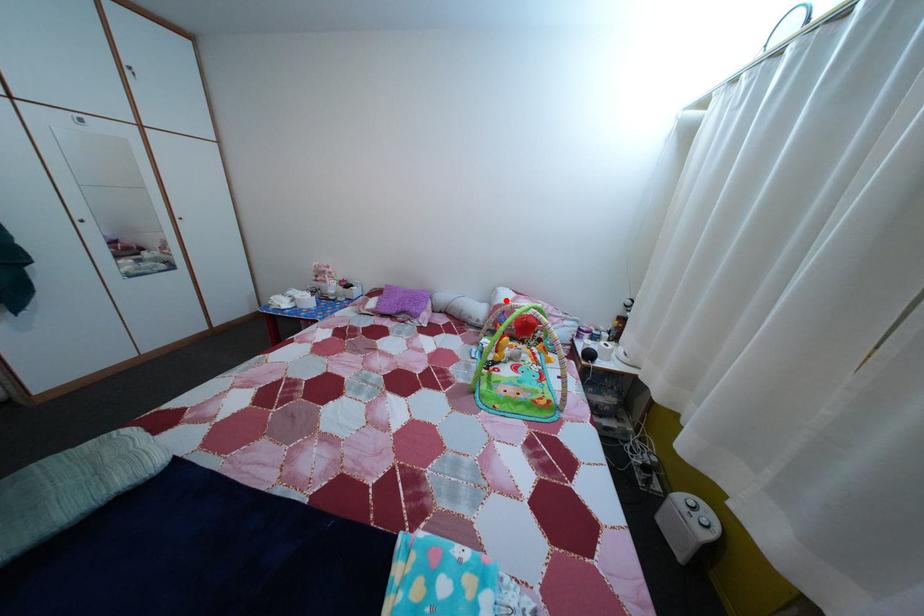
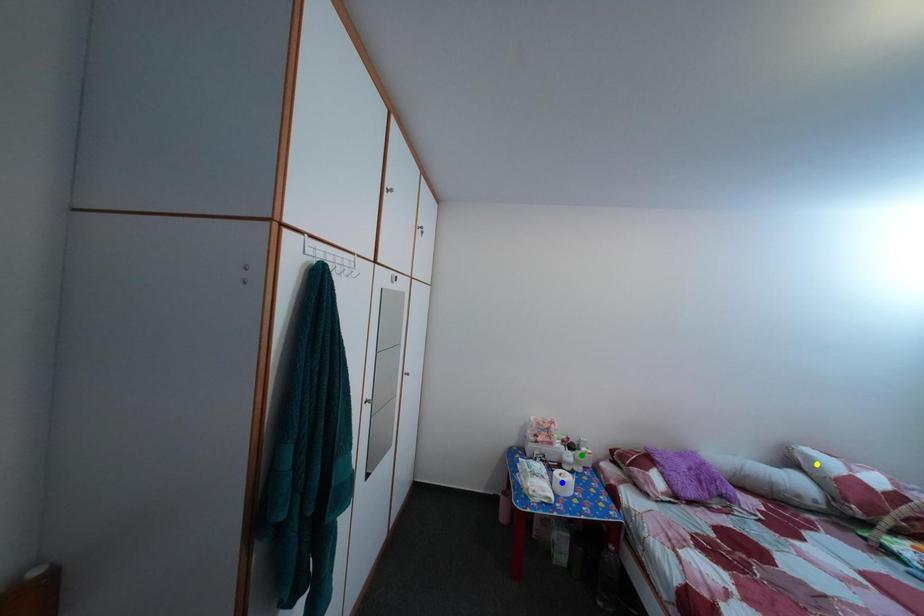
Question: I am providing you with two images of the same scene from different viewpoints. A red point is marked on the first image. You are given multiple points on the second image. In image 2, which mark is for the same physical point as the one in image 1?

Choices:
 (A) yellow point
 (B) blue point
 (C) green point

Answer: (A)